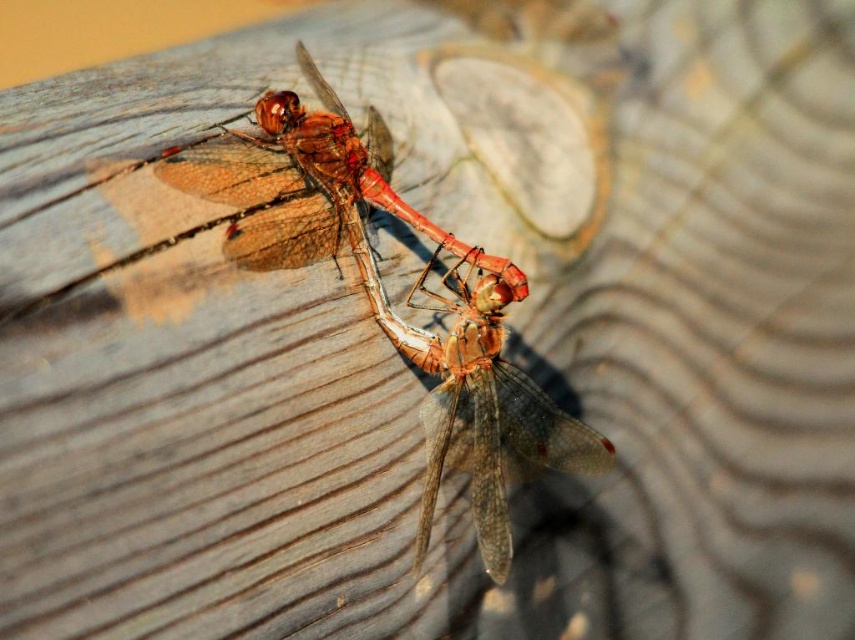
Question: Is translucent amber wings at center closer to the viewer compared to translucent amber dragonfly at center?

Choices:
 (A) no
 (B) yes

Answer: (B)

Question: Which object appears closest to the camera in this image?

Choices:
 (A) translucent amber dragonfly at center
 (B) translucent amber wings at upper center
 (C) translucent amber wings at center

Answer: (B)

Question: Does translucent amber wings at center have a smaller size compared to translucent amber wings at upper center?

Choices:
 (A) yes
 (B) no

Answer: (B)

Question: Is translucent amber wings at center further to the viewer compared to translucent amber dragonfly at center?

Choices:
 (A) no
 (B) yes

Answer: (A)

Question: Which is nearer to the translucent amber wings at upper center?

Choices:
 (A) translucent amber wings at center
 (B) translucent amber dragonfly at center

Answer: (A)

Question: Which object is closer to the camera taking this photo?

Choices:
 (A) translucent amber dragonfly at center
 (B) translucent amber wings at center
 (C) translucent amber wings at upper center

Answer: (C)